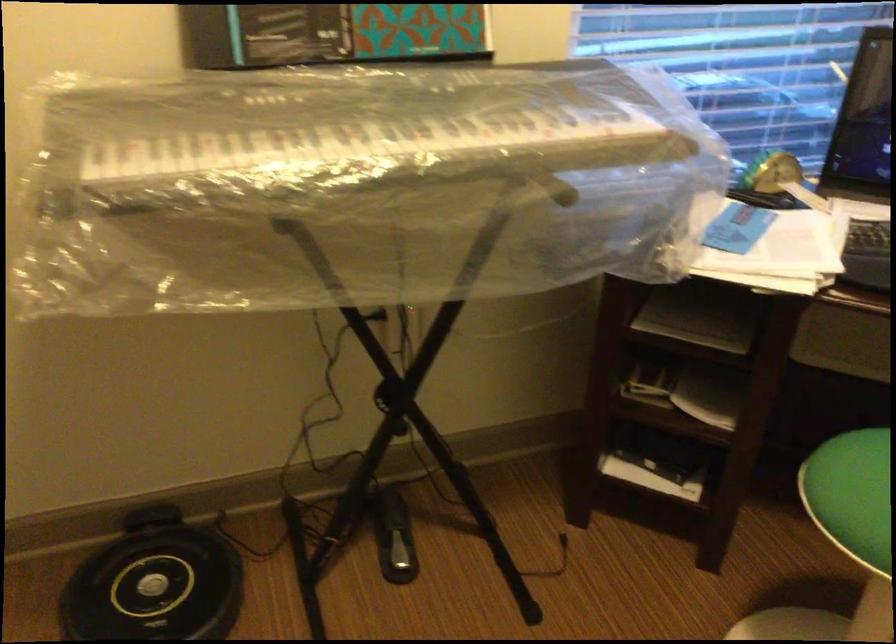
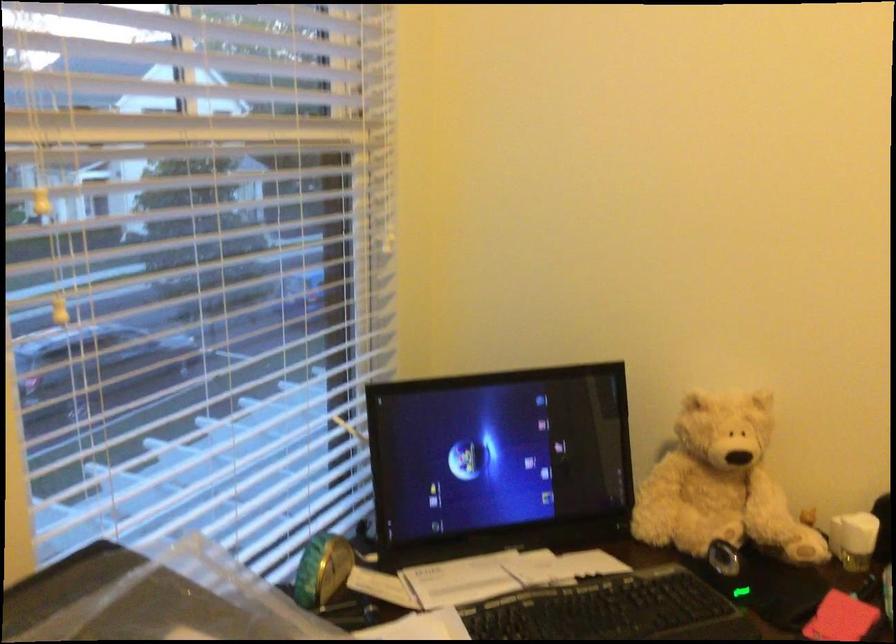
In the second image, find the point that corresponds to point (791, 160) in the first image.

(322, 569)